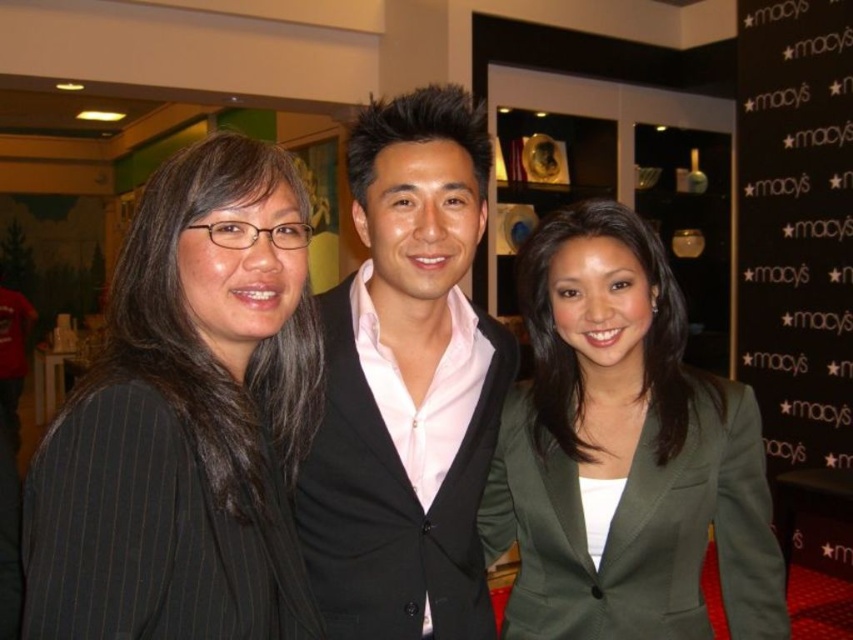
Question: Does green matte blazer at center come behind black fabric at right?

Choices:
 (A) yes
 (B) no

Answer: (B)

Question: Which of the following is the farthest from the observer?

Choices:
 (A) (376, 400)
 (B) (830, 424)
 (C) (247, 499)

Answer: (B)

Question: Which point is closer to the camera?

Choices:
 (A) [737, 10]
 (B) [364, 230]
 (C) [172, 193]
 (D) [674, 563]

Answer: (C)

Question: Can you confirm if black pinstripe blazer at left is bigger than black fabric at right?

Choices:
 (A) yes
 (B) no

Answer: (B)

Question: Where is black pinstripe blazer at left located in relation to matte black suit at center in the image?

Choices:
 (A) above
 (B) below

Answer: (B)

Question: Among these points, which one is farthest from the camera?

Choices:
 (A) (164, 548)
 (B) (575, 621)
 (C) (495, 336)

Answer: (C)